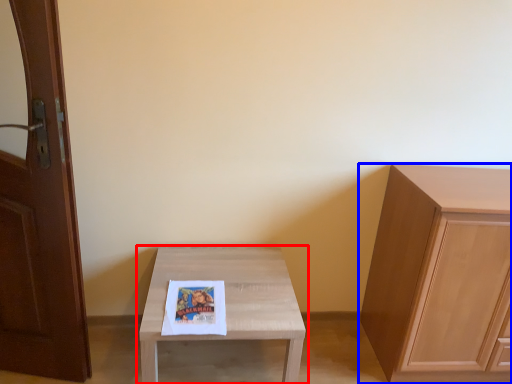
Question: Which object is closer to the camera taking this photo, table (highlighted by a red box) or cabinetry (highlighted by a blue box)?

Choices:
 (A) table
 (B) cabinetry

Answer: (A)